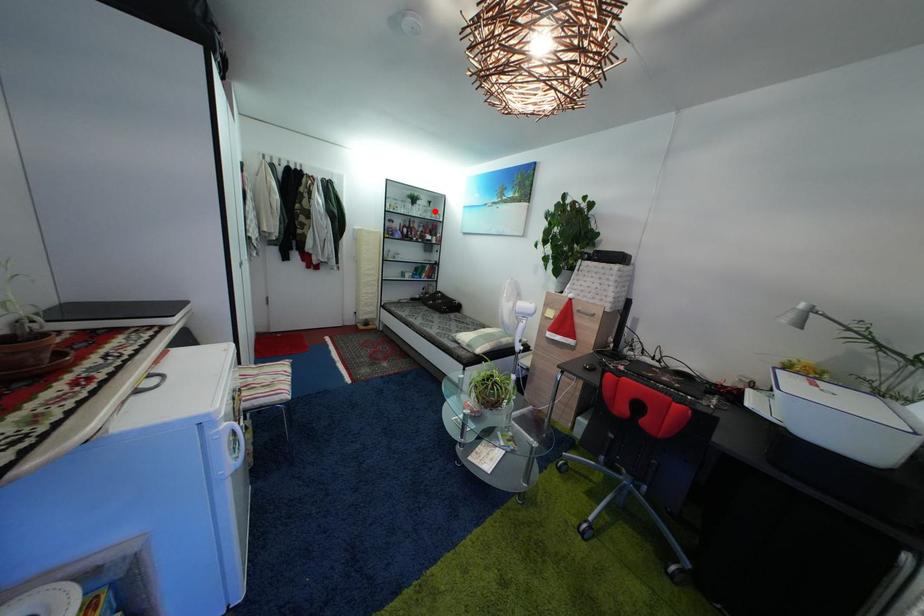
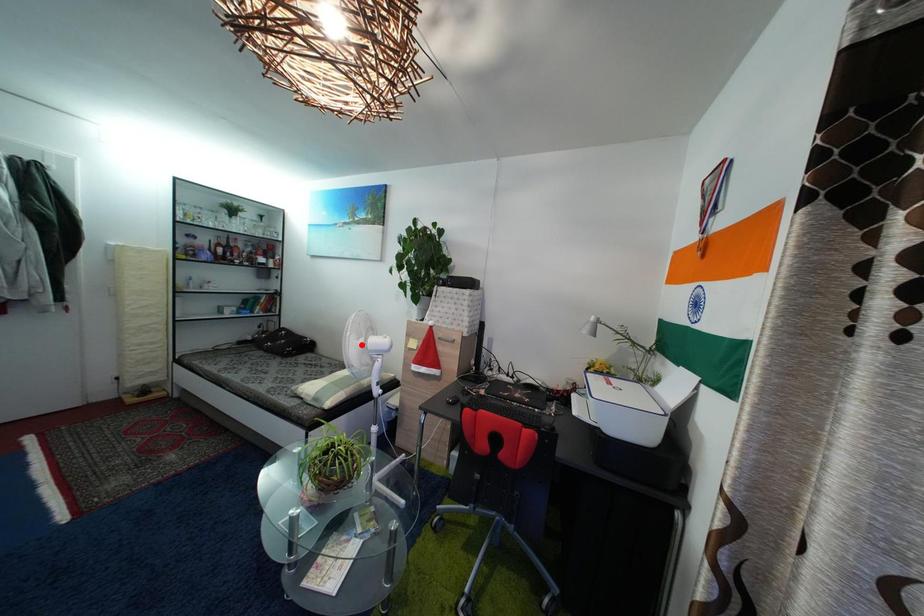
I am providing you with two images of the same scene from different viewpoints. A red point is marked on the first image and another point is marked on the second image. Is the marked point in image1 the same physical position as the marked point in image2?

No